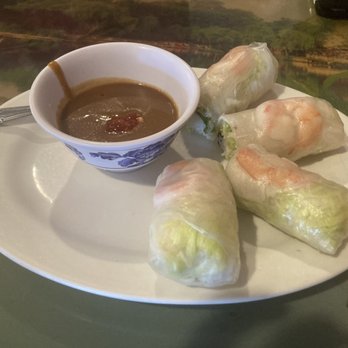
You are a GUI agent. You are given a task and a screenshot of the screen. Output one action in this format:
    pyautogui.click(x=<x>, y=<y>)
    Task: Click on the handle of fork/spoon
    The width and height of the screenshot is (348, 348).
    Given the screenshot: What is the action you would take?
    pyautogui.click(x=19, y=111)